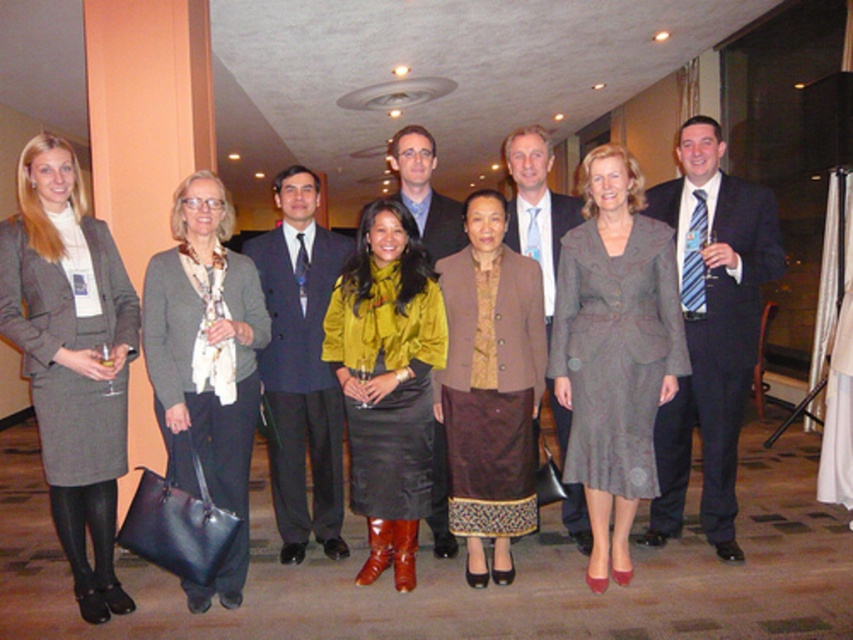
Can you confirm if matte black suit at center is taller than velvet mustard blouse at center?

Yes, matte black suit at center is taller than velvet mustard blouse at center.

The height and width of the screenshot is (640, 853). What do you see at coordinates (711, 328) in the screenshot?
I see `matte black suit at center` at bounding box center [711, 328].

Who is more distant from viewer, (x=695, y=340) or (x=419, y=444)?

The point (x=695, y=340) is more distant.

Identify the location of matte black suit at center. (711, 328).

Does matte gray suit at center have a lesser height compared to matte blue suit at center?

A: No.

Which is in front, point (630, 435) or point (567, 426)?

Positioned in front is point (630, 435).

Find the location of a particular element. This screenshot has width=853, height=640. matte gray suit at center is located at coordinates (614, 353).

The image size is (853, 640). What do you see at coordinates (614, 353) in the screenshot?
I see `matte gray suit at center` at bounding box center [614, 353].

Who is more distant from viewer, (631, 484) or (306, 236)?

Positioned behind is point (306, 236).

The width and height of the screenshot is (853, 640). Find the location of `matte gray suit at center`. matte gray suit at center is located at coordinates (614, 353).